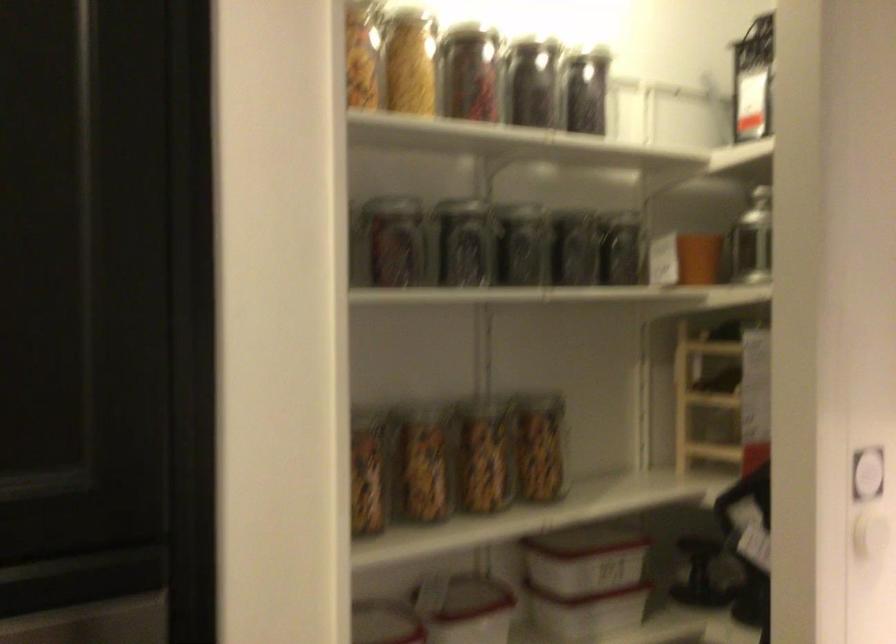
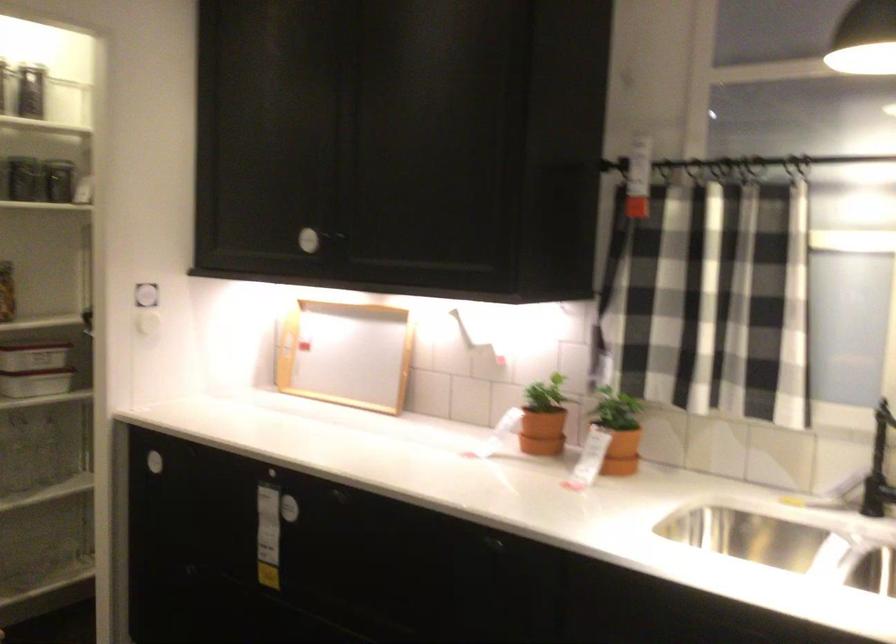
Question: I am providing you with two images of the same scene from different viewpoints. Please identify which objects are invisible in image2.

Choices:
 (A) terracotta plant pot
 (B) small black mirror
 (C) black faucet handle
 (D) black lantern handle

Answer: (D)